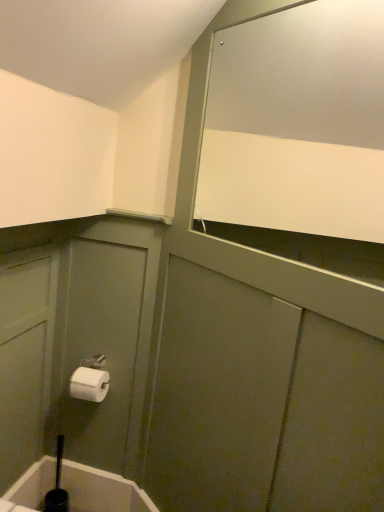
Question: Is white glossy mirror at upper right taller or shorter than black rubber toilet brush at lower left?

Choices:
 (A) tall
 (B) short

Answer: (A)

Question: Is point (208, 198) closer or farther from the camera than point (112, 493)?

Choices:
 (A) farther
 (B) closer

Answer: (B)

Question: Which of these objects is positioned closest to the white glossy mirror at upper right?

Choices:
 (A) black rubber toilet brush at lower left
 (B) white matte toilet paper at lower left

Answer: (B)

Question: Which is farther from the white matte toilet paper at lower left?

Choices:
 (A) white glossy mirror at upper right
 (B) black rubber toilet brush at lower left

Answer: (A)